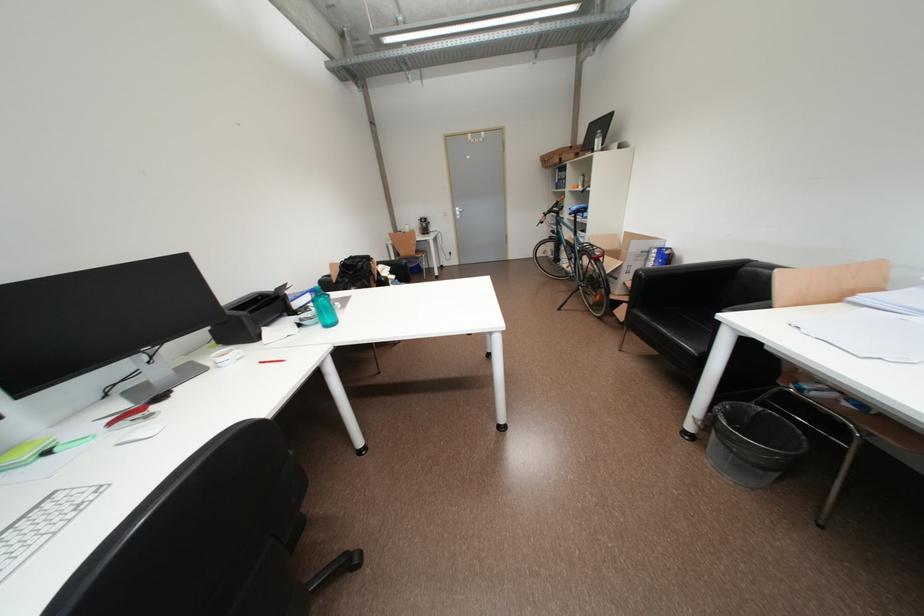
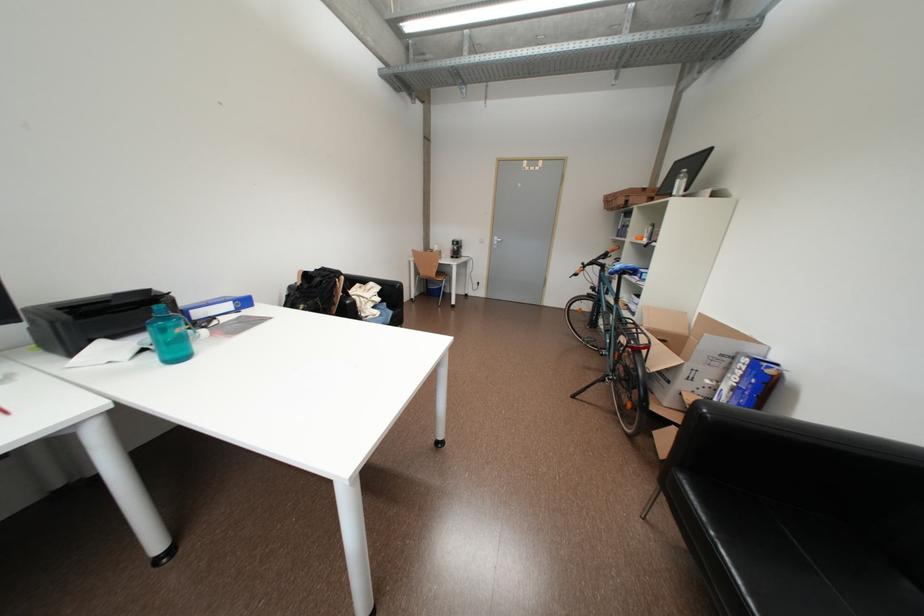
The point at (582, 209) is marked in the first image. Where is the corresponding point in the second image?

(626, 268)